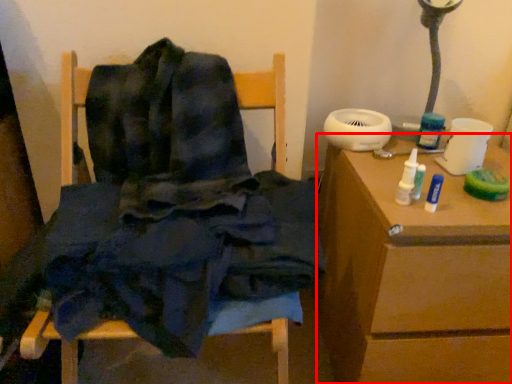
Question: Where is table (annotated by the red box) located in relation to furniture in the image?

Choices:
 (A) right
 (B) left

Answer: (A)